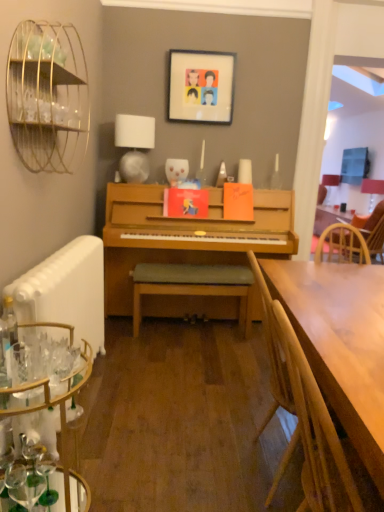
Find the location of a particular element. The image size is (384, 512). vacant region above matte plastic picture frame at upper center (from a real-world perspective) is located at coordinates (210, 47).